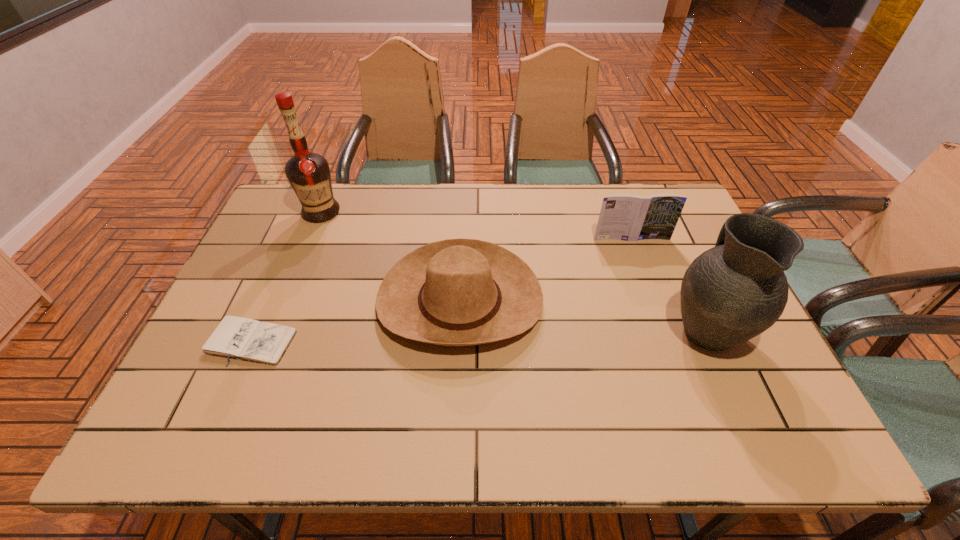
Where is `free space between the second farthest object and the pitcher`? This screenshot has width=960, height=540. free space between the second farthest object and the pitcher is located at coordinates (669, 284).

The width and height of the screenshot is (960, 540). Find the location of `the fourth closest object to the notebook`. the fourth closest object to the notebook is located at coordinates (731, 293).

Choose which object is the third nearest neighbor to the fourth nearest object. Please provide its 2D coordinates. Your answer should be formatted as a tuple, i.e. [(x, y)], where the tuple contains the x and y coordinates of a point satisfying the conditions above.

[(308, 173)]